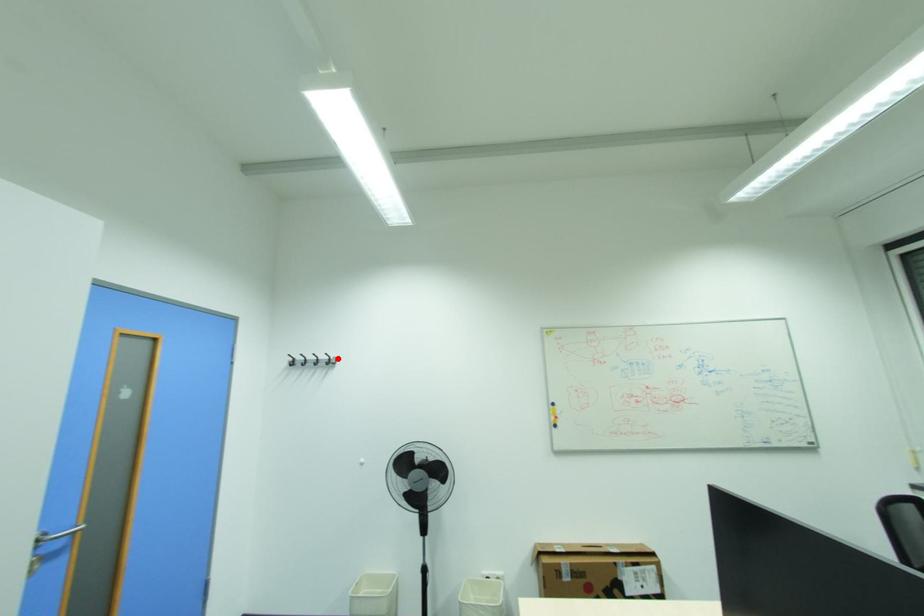
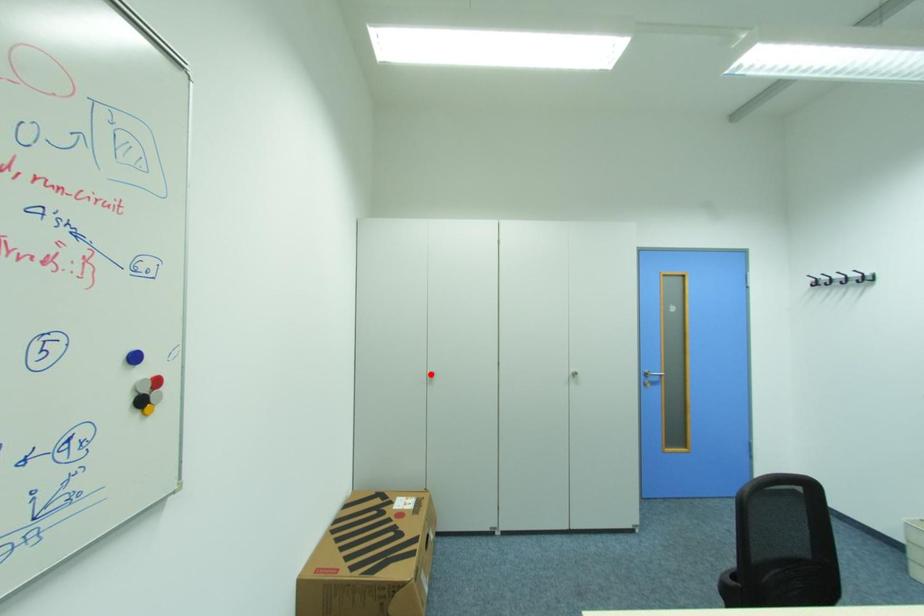
I am providing you with two images of the same scene from different viewpoints. A red point is marked on the first image and another point is marked on the second image. Does the point marked in image1 correspond to the same location as the one in image2?

No